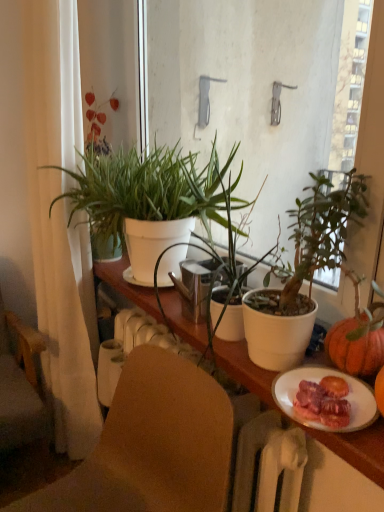
Question: Considering the positions of white matte cabinet at center and green matte plant at center, which is counted as the first houseplant, starting from the front, in the image, is white matte cabinet at center bigger or smaller than green matte plant at center, which is counted as the first houseplant, starting from the front,?

Choices:
 (A) big
 (B) small

Answer: (A)

Question: Considering the positions of point (238, 379) and point (200, 177), is point (238, 379) closer or farther from the camera than point (200, 177)?

Choices:
 (A) farther
 (B) closer

Answer: (B)

Question: Which of these objects is positioned closest to the white matte plant pot at center, positioned as the first houseplant in back-to-front order?

Choices:
 (A) wooden chair at left, the 1th chair from the left
 (B) white matte cabinet at center
 (C) white fabric curtain at left
 (D) brown fabric chair at lower center, which is the 2th chair in back-to-front order
 (E) white ceramic plate at lower right

Answer: (B)

Question: Estimate the real-world distances between objects in this image. Which object is farther from the white fabric curtain at left?

Choices:
 (A) white ceramic plate at lower right
 (B) white matte cabinet at center
 (C) green matte plant at center, which is counted as the first houseplant, starting from the front
 (D) white matte plant pot at center, positioned as the first houseplant in back-to-front order
 (E) brown fabric chair at lower center, positioned as the second chair in left-to-right order

Answer: (A)